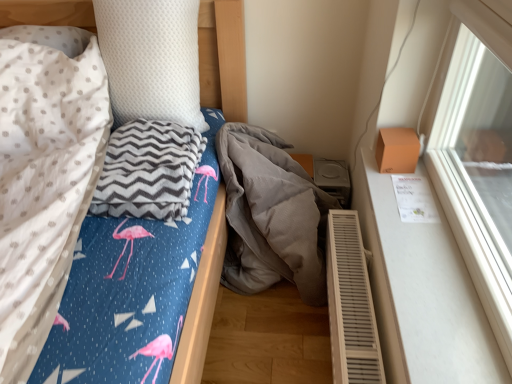
Question: Is gray chevron blanket at left, which ranks as the 1th material in left-to-right order, to the right of white matte window sill at right from the viewer's perspective?

Choices:
 (A) no
 (B) yes

Answer: (A)

Question: Can you confirm if gray chevron blanket at left, which is the 2th material from right to left, is smaller than white matte window sill at right?

Choices:
 (A) yes
 (B) no

Answer: (B)

Question: Does gray chevron blanket at left, which ranks as the 1th material in left-to-right order, have a larger size compared to white matte window sill at right?

Choices:
 (A) yes
 (B) no

Answer: (A)

Question: Can you confirm if gray chevron blanket at left, which is the 2th material from right to left, is thinner than white matte window sill at right?

Choices:
 (A) no
 (B) yes

Answer: (A)

Question: From the image's perspective, is gray chevron blanket at left, which ranks as the 1th material in left-to-right order, located beneath white matte window sill at right?

Choices:
 (A) no
 (B) yes

Answer: (A)

Question: Do you think gray chevron blanket at left, which is the 2th material from right to left, is within white plastic air conditioner at lower right, or outside of it?

Choices:
 (A) outside
 (B) inside

Answer: (A)

Question: In terms of height, does gray chevron blanket at left, which is the 2th material from right to left, look taller or shorter compared to white plastic air conditioner at lower right?

Choices:
 (A) short
 (B) tall

Answer: (A)

Question: Considering the positions of point pos(165,130) and point pos(354,296), is point pos(165,130) closer or farther from the camera than point pos(354,296)?

Choices:
 (A) closer
 (B) farther

Answer: (B)

Question: In terms of width, does gray chevron blanket at left, which ranks as the 1th material in left-to-right order, look wider or thinner when compared to white plastic air conditioner at lower right?

Choices:
 (A) wide
 (B) thin

Answer: (A)

Question: Considering the positions of white plastic air conditioner at lower right and white matte window sill at right in the image, is white plastic air conditioner at lower right wider or thinner than white matte window sill at right?

Choices:
 (A) wide
 (B) thin

Answer: (B)

Question: Is white plastic air conditioner at lower right situated inside white matte window sill at right or outside?

Choices:
 (A) inside
 (B) outside

Answer: (B)

Question: From the image's perspective, is white plastic air conditioner at lower right above or below white matte window sill at right?

Choices:
 (A) above
 (B) below

Answer: (B)

Question: In the image, is white plastic air conditioner at lower right on the left side or the right side of white matte window sill at right?

Choices:
 (A) left
 (B) right

Answer: (A)

Question: In the image, is white matte window sill at right on the left side or the right side of gray chevron blanket at left, which ranks as the 1th material in left-to-right order?

Choices:
 (A) right
 (B) left

Answer: (A)

Question: Considering the positions of white matte window sill at right and gray chevron blanket at left, which is the 2th material from right to left, in the image, is white matte window sill at right taller or shorter than gray chevron blanket at left, which is the 2th material from right to left,?

Choices:
 (A) short
 (B) tall

Answer: (A)